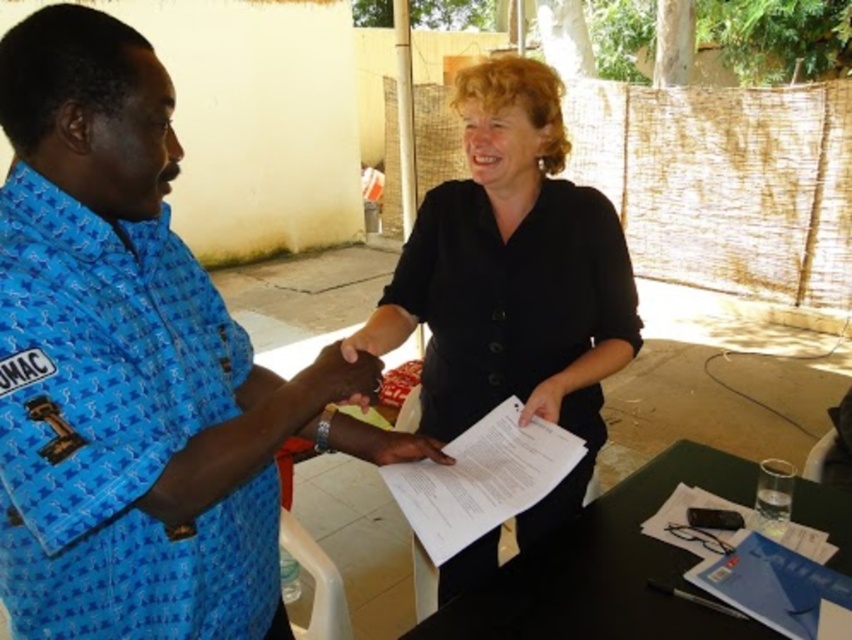
Is point (302, 410) farther from viewer compared to point (507, 429)?

No, (302, 410) is in front of (507, 429).

Who is shorter, blue printed shirt at center or white paper at center?

Standing shorter between the two is white paper at center.

Between point (102, 138) and point (542, 456), which one is positioned behind?

The point (542, 456) is more distant.

Where is `blue printed shirt at center`? The image size is (852, 640). blue printed shirt at center is located at coordinates (125, 365).

Between blue printed shirt at center and white paper at lower right, which one has more height?

blue printed shirt at center

Is blue printed shirt at center bigger than white paper at lower right?

Indeed, blue printed shirt at center has a larger size compared to white paper at lower right.

This screenshot has height=640, width=852. Describe the element at coordinates (125, 365) in the screenshot. I see `blue printed shirt at center` at that location.

This screenshot has height=640, width=852. Identify the location of blue printed shirt at center. (125, 365).

Is black matte shirt at center positioned in front of dark skin hand at center?

No, it is not.

Is black matte shirt at center above dark skin hand at center?

Actually, black matte shirt at center is below dark skin hand at center.

Is point (551, 326) positioned before point (369, 371)?

No, it is not.

Image resolution: width=852 pixels, height=640 pixels. Find the location of `black matte shirt at center`. black matte shirt at center is located at coordinates (513, 280).